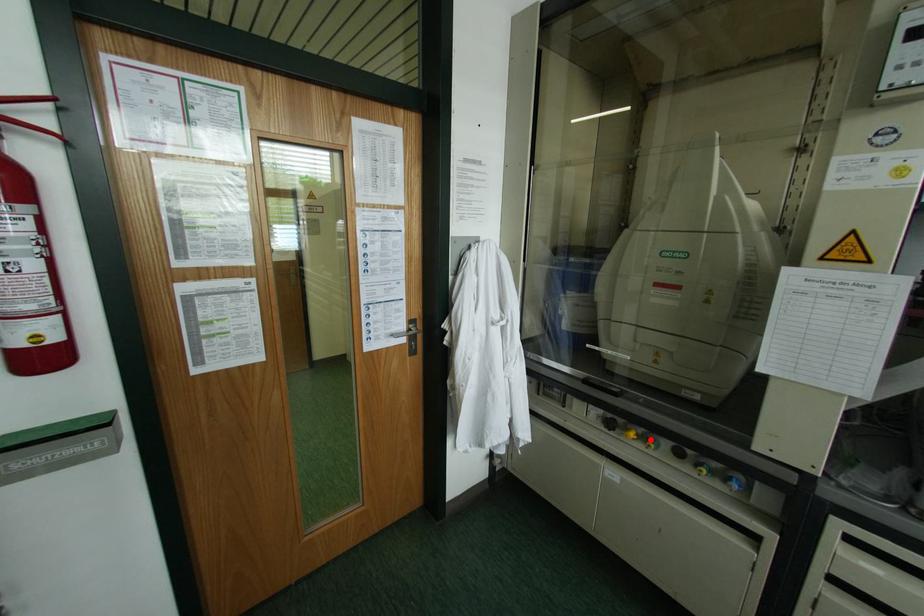
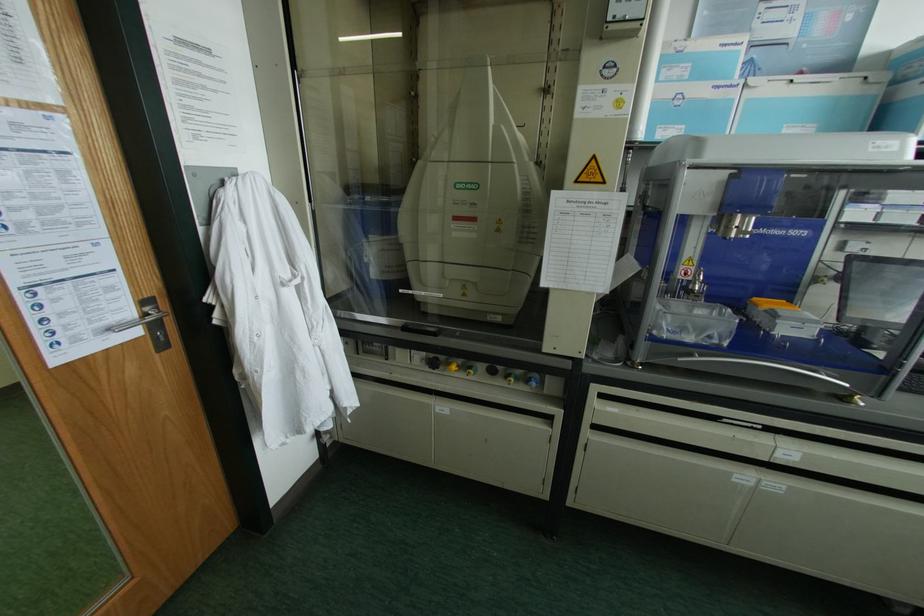
In the second image, find the point that corresponds to the highlighted location in the first image.

(469, 367)